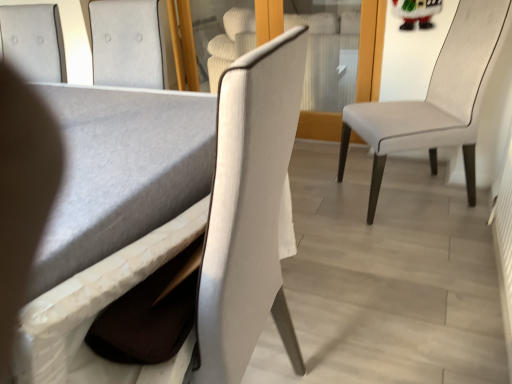
Question: Is matte white chair at center, which is counted as the second chair, starting from the right, to the left or to the right of matte gray table at lower left in the image?

Choices:
 (A) left
 (B) right

Answer: (B)

Question: Is matte white chair at center, which is counted as the second chair, starting from the right, taller or shorter than matte gray table at lower left?

Choices:
 (A) short
 (B) tall

Answer: (A)

Question: Considering the real-world distances, which object is farthest from the matte white chair at center, which ranks as the 2th chair in left-to-right order?

Choices:
 (A) white leather chair at right, which is counted as the 3th chair, starting from the left
 (B) transparent glass door at center
 (C) matte gray table at lower left
 (D) textured gray cushion at upper left, marked as the first chair in a left-to-right arrangement

Answer: (B)

Question: Which object is the closest to the transparent glass door at center?

Choices:
 (A) textured gray cushion at upper left, marked as the first chair in a left-to-right arrangement
 (B) white leather chair at right, which is counted as the 3th chair, starting from the left
 (C) matte gray table at lower left
 (D) matte white chair at center, which is counted as the second chair, starting from the right

Answer: (B)